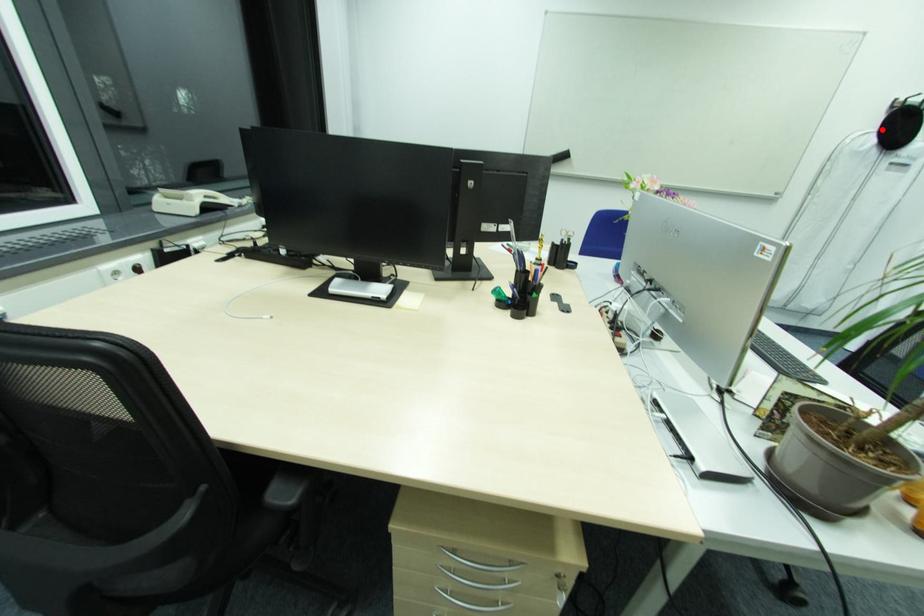
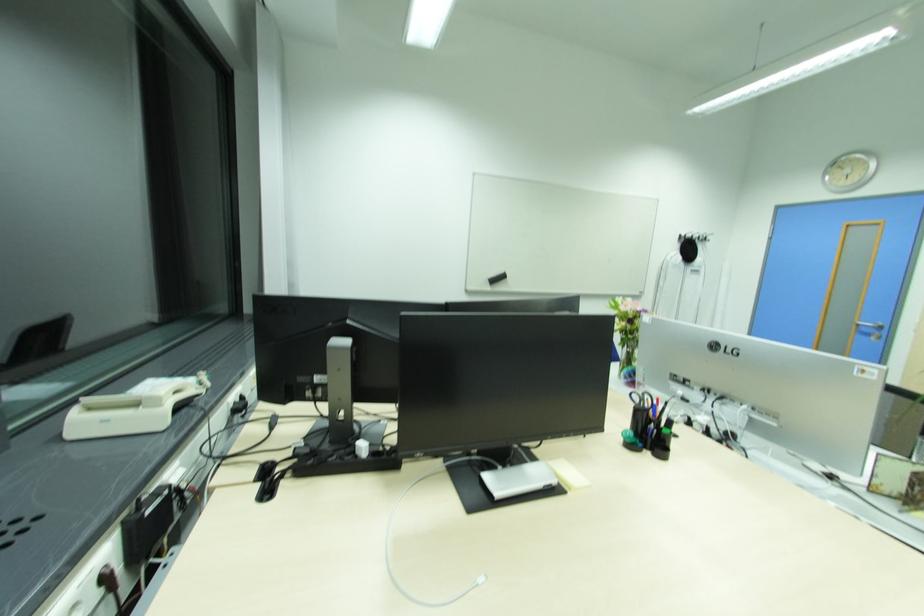
Find the pixel in the second image that matches the highlighted location in the first image.

(684, 251)